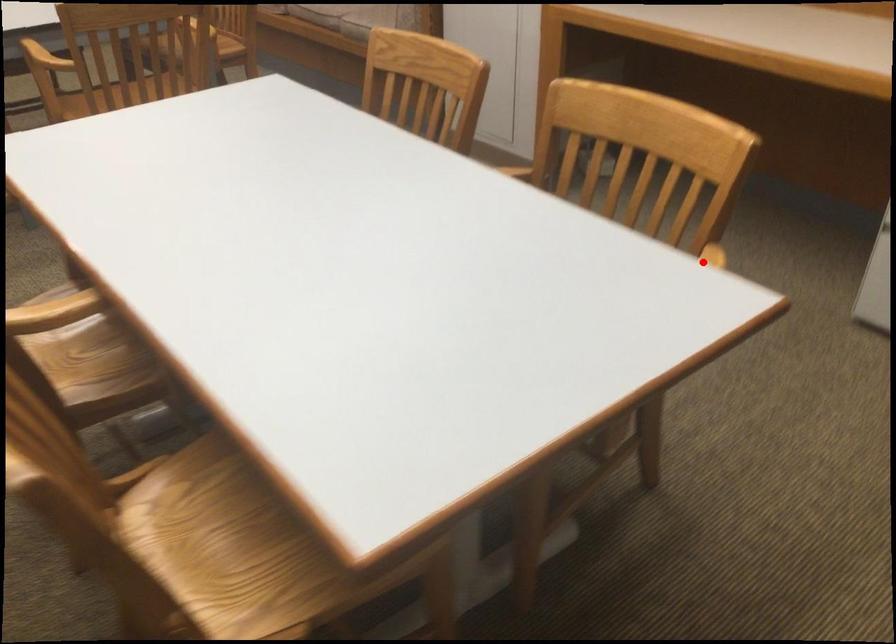
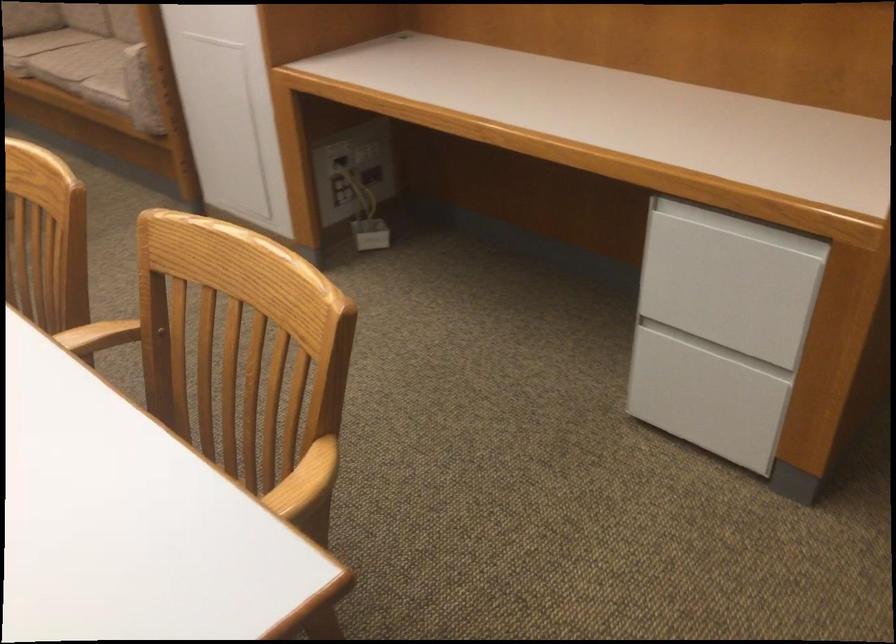
The point at the highlighted location is marked in the first image. Where is the corresponding point in the second image?

(304, 482)